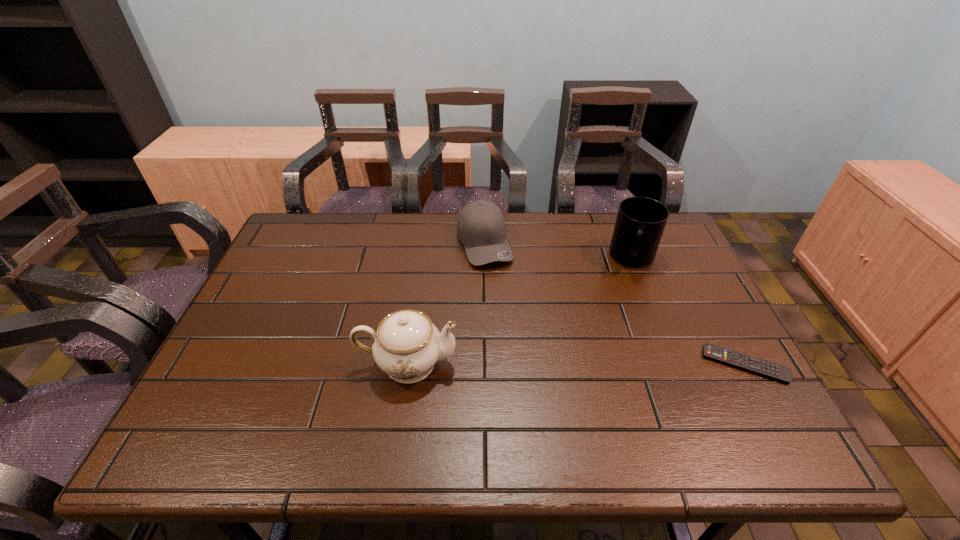
The height and width of the screenshot is (540, 960). Find the location of `object that is at the near right corner`. object that is at the near right corner is located at coordinates pos(741,361).

The image size is (960, 540). Find the location of `vacant area at the far edge of the desktop`. vacant area at the far edge of the desktop is located at coordinates point(548,245).

In the image, there is a desktop. Where is `vacant space at the near edge`? The width and height of the screenshot is (960, 540). vacant space at the near edge is located at coordinates (634, 408).

Locate an element on the screen. This screenshot has width=960, height=540. vacant space at the left edge is located at coordinates (310, 285).

I want to click on free space at the right edge, so click(683, 281).

Where is `vacant region at the far left corner of the desktop`? Image resolution: width=960 pixels, height=540 pixels. vacant region at the far left corner of the desktop is located at coordinates (304, 212).

This screenshot has height=540, width=960. I want to click on vacant area that lies between the mug and the second shortest object, so click(559, 251).

Find the location of a particular element. free area in between the chinaware and the second shortest object is located at coordinates (446, 303).

Identify the location of free space between the chinaware and the third tallest object. (446, 303).

Where is `unoccupied position between the mug and the second shortest object`? unoccupied position between the mug and the second shortest object is located at coordinates pyautogui.click(x=559, y=251).